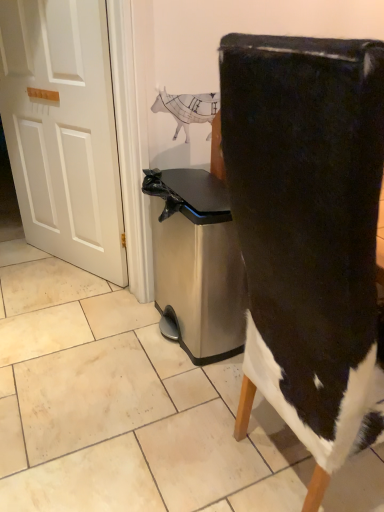
Question: Does white matte door at left appear on the left side of black suede chair at center?

Choices:
 (A) no
 (B) yes

Answer: (B)

Question: Is white matte door at left positioned with its back to black suede chair at center?

Choices:
 (A) no
 (B) yes

Answer: (A)

Question: Does white matte door at left have a lesser width compared to black suede chair at center?

Choices:
 (A) no
 (B) yes

Answer: (B)

Question: From the image's perspective, is white matte door at left over black suede chair at center?

Choices:
 (A) yes
 (B) no

Answer: (A)

Question: Considering the relative sizes of white matte door at left and black suede chair at center in the image provided, is white matte door at left shorter than black suede chair at center?

Choices:
 (A) yes
 (B) no

Answer: (B)

Question: Looking at their shapes, would you say black suede chair at center is wider or thinner than stainless steel trash can at center?

Choices:
 (A) wide
 (B) thin

Answer: (A)

Question: Considering their positions, is black suede chair at center located in front of or behind stainless steel trash can at center?

Choices:
 (A) front
 (B) behind

Answer: (A)

Question: From a real-world perspective, is black suede chair at center above or below stainless steel trash can at center?

Choices:
 (A) above
 (B) below

Answer: (A)

Question: Is point (266, 362) closer or farther from the camera than point (221, 246)?

Choices:
 (A) closer
 (B) farther

Answer: (A)

Question: From a real-world perspective, is stainless steel trash can at center physically located above or below white matte door at left?

Choices:
 (A) above
 (B) below

Answer: (B)

Question: In terms of width, does stainless steel trash can at center look wider or thinner when compared to white matte door at left?

Choices:
 (A) wide
 (B) thin

Answer: (A)

Question: From the image's perspective, is stainless steel trash can at center positioned above or below white matte door at left?

Choices:
 (A) below
 (B) above

Answer: (A)

Question: Is stainless steel trash can at center taller or shorter than white matte door at left?

Choices:
 (A) tall
 (B) short

Answer: (B)

Question: Looking at the image, does white matte door at left seem bigger or smaller compared to black suede chair at center?

Choices:
 (A) small
 (B) big

Answer: (A)

Question: Is white matte door at left to the left or to the right of black suede chair at center in the image?

Choices:
 (A) left
 (B) right

Answer: (A)